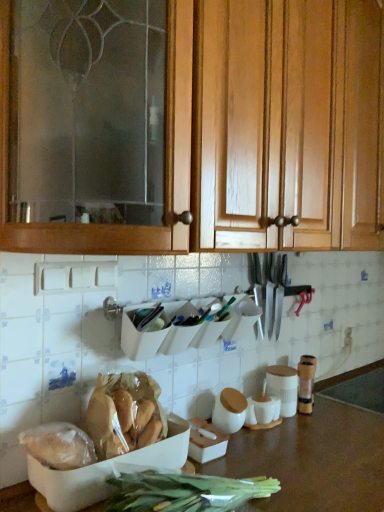
Question: Looking at the image, does polished silver knife set at center seem bigger or smaller compared to translucent plastic bag of bread at lower left, the first food in the left-to-right sequence?

Choices:
 (A) small
 (B) big

Answer: (B)

Question: Visually, is polished silver knife set at center positioned to the left or to the right of translucent plastic bag of bread at lower left, the 2th food from the right?

Choices:
 (A) right
 (B) left

Answer: (A)

Question: Considering the real-world distances, which object is farthest from the translucent plastic bag of bread at lower left, the 2th food from the right?

Choices:
 (A) polished silver knife set at center
 (B) brown matte countertop at lower center
 (C) wooden cabinet at upper center
 (D) translucent plastic bag of bread at lower left, the 1th food in the right-to-left sequence

Answer: (C)

Question: Which of these objects is positioned closest to the translucent plastic bag of bread at lower left, the 2th food from the right?

Choices:
 (A) brown matte countertop at lower center
 (B) translucent plastic bag of bread at lower left, the second food in the left-to-right sequence
 (C) wooden cabinet at upper center
 (D) polished silver knife set at center

Answer: (B)